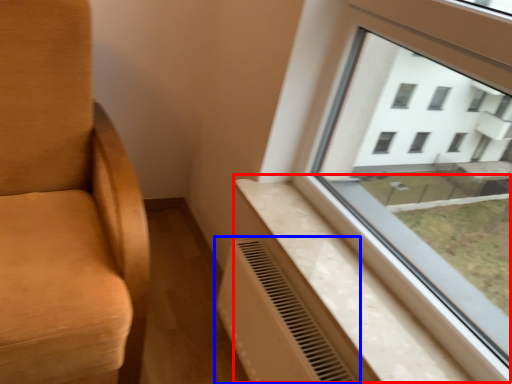
Question: Among these objects, which one is farthest to the camera, window sill (highlighted by a red box) or air conditioning (highlighted by a blue box)?

Choices:
 (A) window sill
 (B) air conditioning

Answer: (B)